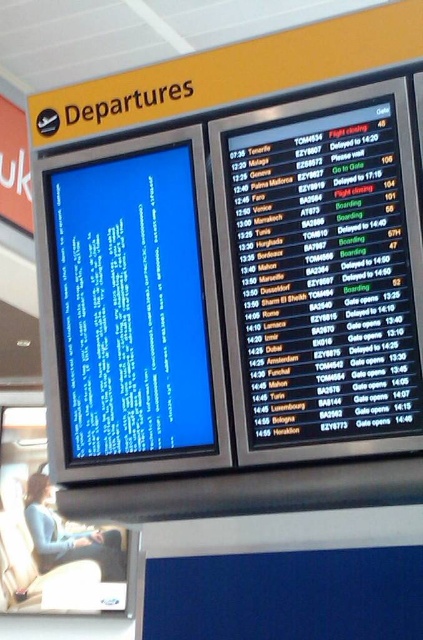
Question: Can you confirm if black glossy departure board at upper right is positioned below blue glossy screen at left?

Choices:
 (A) no
 (B) yes

Answer: (A)

Question: Which point is closer to the camera taking this photo?

Choices:
 (A) (286, 141)
 (B) (175, 342)

Answer: (A)

Question: Which object is farther from the camera taking this photo?

Choices:
 (A) black glossy departure board at upper right
 (B) blue glossy screen at left

Answer: (B)

Question: Can you confirm if black glossy departure board at upper right is thinner than blue glossy screen at left?

Choices:
 (A) yes
 (B) no

Answer: (B)

Question: Which point appears closest to the camera in this image?

Choices:
 (A) (197, 349)
 (B) (315, 253)

Answer: (B)

Question: Is black glossy departure board at upper right wider than blue glossy screen at left?

Choices:
 (A) no
 (B) yes

Answer: (B)